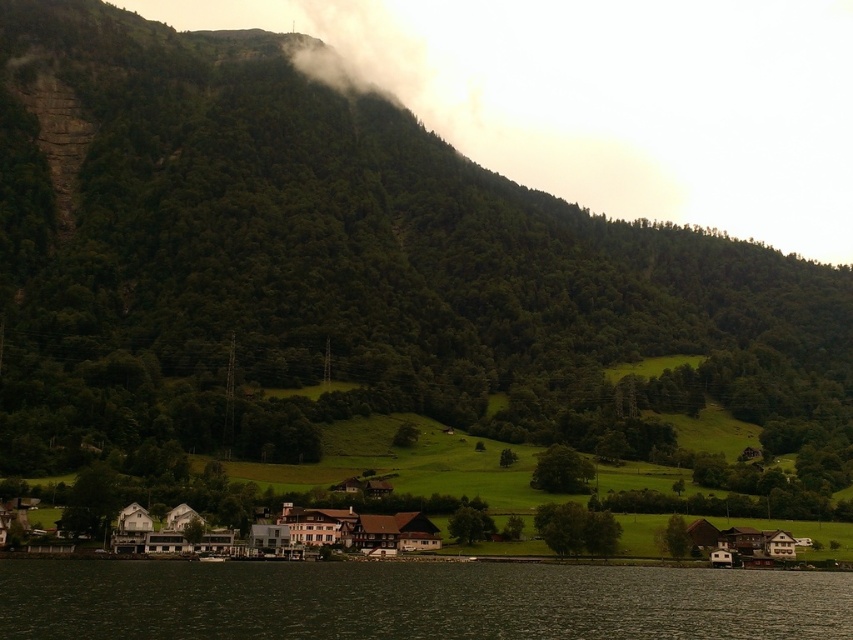
Question: Can you confirm if dark green water at lower center is positioned above white fog at upper center?

Choices:
 (A) yes
 (B) no

Answer: (B)

Question: Can you confirm if dark green water at lower center is wider than white fog at upper center?

Choices:
 (A) no
 (B) yes

Answer: (A)

Question: Is dark green water at lower center to the left of white fog at upper center from the viewer's perspective?

Choices:
 (A) yes
 (B) no

Answer: (A)

Question: Which object appears farthest from the camera in this image?

Choices:
 (A) white fog at upper center
 (B) dark green water at lower center

Answer: (A)